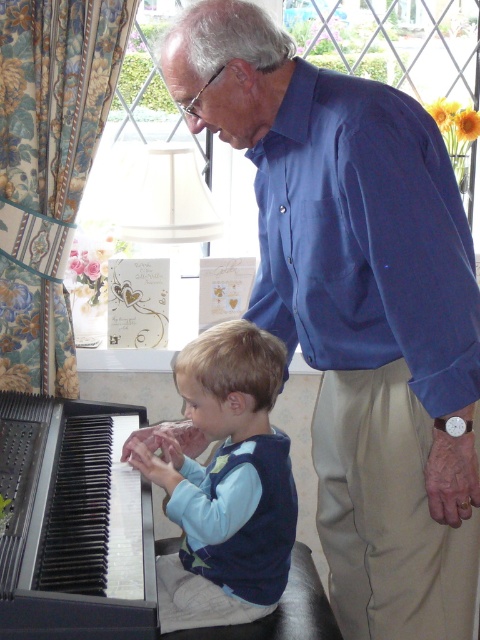
Who is higher up, blue shirt at upper center or light blue cotton shirt at center?

blue shirt at upper center

Is blue shirt at upper center smaller than light blue cotton shirt at center?

No.

Is point (337, 86) more distant than point (251, 612)?

No, it is in front of (251, 612).

At what (x,y) coordinates should I click in order to perform the action: click on blue shirt at upper center. Please return your answer as a coordinate pair (x, y). Looking at the image, I should click on (358, 308).

Can you confirm if blue shirt at upper center is wider than black plastic piano at lower left?

Yes.

Looking at this image, how distant is blue shirt at upper center from black plastic piano at lower left?

24.62 inches

Where is `blue shirt at upper center`? This screenshot has height=640, width=480. blue shirt at upper center is located at coordinates (358, 308).

Looking at this image, is light blue cotton shirt at center thinner than black plastic piano at lower left?

Correct, light blue cotton shirt at center's width is less than black plastic piano at lower left's.

Image resolution: width=480 pixels, height=640 pixels. I want to click on light blue cotton shirt at center, so point(227,483).